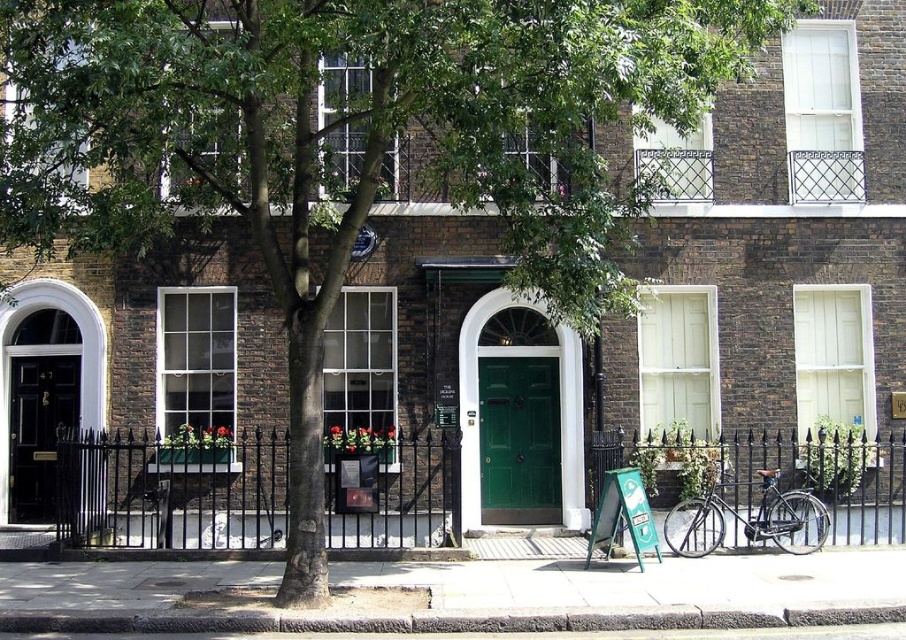
How distant is black glossy door at left from shiny black bicycle at lower right?

black glossy door at left is 7.77 meters from shiny black bicycle at lower right.

Is black glossy door at left below shiny black bicycle at lower right?

No.

Which is in front, point (34, 461) or point (808, 516)?

Positioned in front is point (808, 516).

Where is `black glossy door at left`? This screenshot has width=906, height=640. black glossy door at left is located at coordinates (37, 429).

Between green matte door at center and shiny black bicycle at lower right, which one appears on the left side from the viewer's perspective?

Positioned to the left is green matte door at center.

How far apart are green matte door at center and shiny black bicycle at lower right?

green matte door at center and shiny black bicycle at lower right are 2.28 meters apart.

Does point (504, 365) come behind point (791, 538)?

Yes, it is.

You are a GUI agent. You are given a task and a screenshot of the screen. Output one action in this format:
    pyautogui.click(x=<x>, y=<y>)
    Task: Click on the green matte door at center
    
    Given the screenshot: What is the action you would take?
    pyautogui.click(x=519, y=440)

Does green matte door at center come behind black glossy door at left?

That is True.

Who is positioned more to the right, green matte door at center or black glossy door at left?

From the viewer's perspective, green matte door at center appears more on the right side.

This screenshot has height=640, width=906. Describe the element at coordinates (519, 440) in the screenshot. I see `green matte door at center` at that location.

What are the coordinates of `green matte door at center` in the screenshot? It's located at (519, 440).